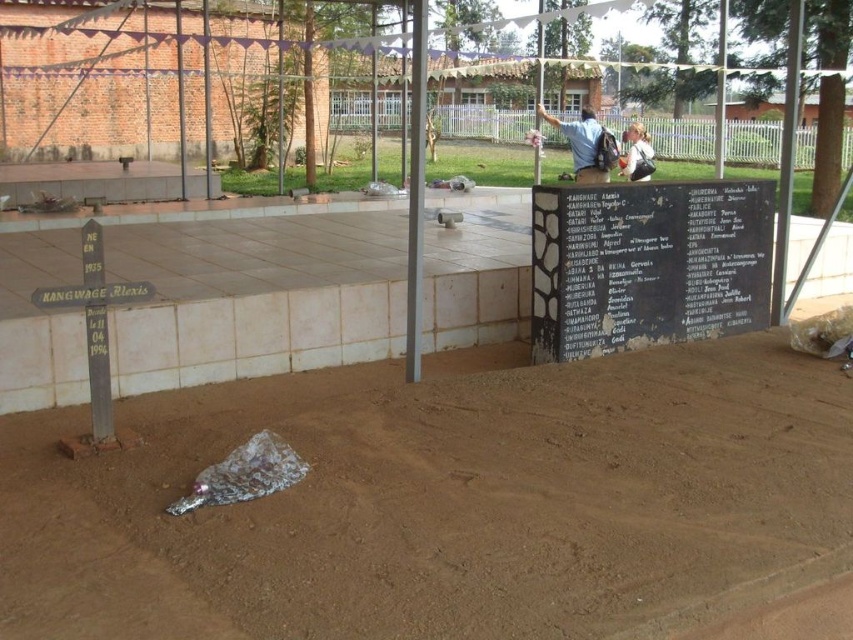
You are a hiker carrying a light brown leather backpack at upper center and you want to walk along the brown dirt track at center. Can you walk through the track with your backpack?

The brown dirt track at center might be wider than light brown leather backpack at upper center, so it is possible that you can walk through the track with your backpack, but there is some uncertainty as the exact width comparison is not confirmed.

You are a hiker carrying a blue fabric backpack at upper center and want to walk along the brown dirt track at center. Can you fit comfortably on the track without the backpack touching the sides?

The brown dirt track at center might be wider than blue fabric backpack at upper center, so there is a possibility that the backpack will not touch the sides, but the exact width is uncertain.